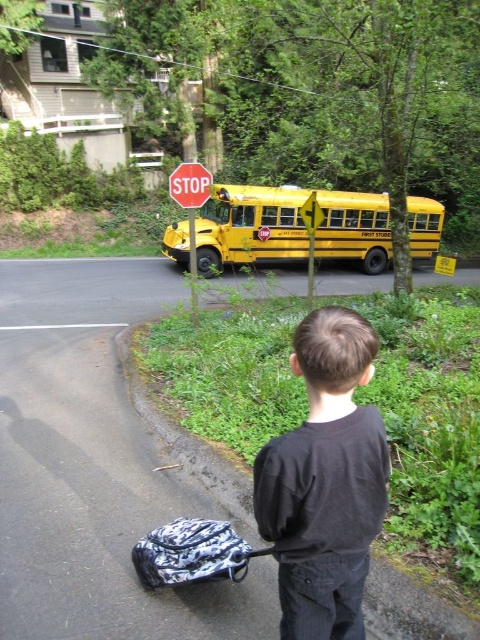
Question: Can you confirm if red plastic stop sign at center is wider than metallic yellow bus at center?

Choices:
 (A) no
 (B) yes

Answer: (B)

Question: Which object is farther from the camera taking this photo?

Choices:
 (A) patterned fabric backpack at lower left
 (B) green grass at lower right

Answer: (B)

Question: Which of these objects is positioned closest to the metallic yellow bus at center?

Choices:
 (A) patterned fabric backpack at lower left
 (B) yellow metallic bus at center

Answer: (B)

Question: Can you confirm if black cotton shirt at center is bigger than yellow plastic stop sign at upper center?

Choices:
 (A) no
 (B) yes

Answer: (A)

Question: Is patterned fabric backpack at lower left smaller than metallic yellow bus at center?

Choices:
 (A) no
 (B) yes

Answer: (A)

Question: Which is farther from the metallic yellow bus at center?

Choices:
 (A) patterned fabric backpack at lower left
 (B) yellow metallic bus at center

Answer: (A)